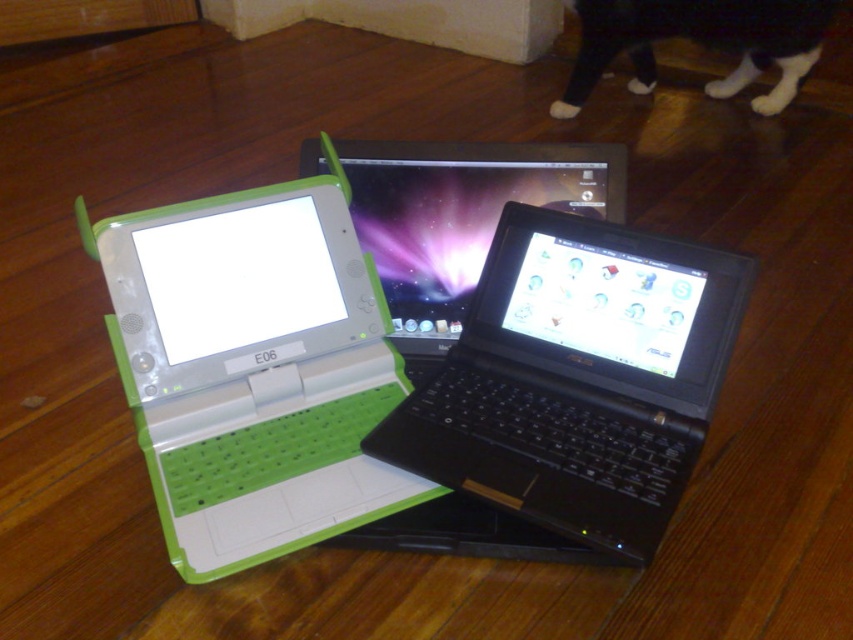
Does black plastic laptop at center appear under black glossy laptop at center?

Indeed, black plastic laptop at center is positioned under black glossy laptop at center.

Can you confirm if black plastic laptop at center is taller than black glossy laptop at center?

Correct, black plastic laptop at center is much taller as black glossy laptop at center.

Between point (512, 385) and point (544, 163), which one is positioned in front?

Point (512, 385) is in front.

The image size is (853, 640). I want to click on black plastic laptop at center, so click(x=577, y=378).

Is black plastic laptop at center below black fur at upper center?

Yes.

Is point (654, 337) behind point (563, 99)?

No, it is not.

Does point (722, 355) come closer to viewer compared to point (659, 28)?

Yes, it is.

The width and height of the screenshot is (853, 640). I want to click on black plastic laptop at center, so click(577, 378).

Is black glossy laptop at center wider than black fur at upper center?

No, black glossy laptop at center is not wider than black fur at upper center.

Which is more to the right, black glossy laptop at center or black fur at upper center?

From the viewer's perspective, black fur at upper center appears more on the right side.

Describe the element at coordinates (459, 218) in the screenshot. This screenshot has width=853, height=640. I see `black glossy laptop at center` at that location.

The image size is (853, 640). Identify the location of black glossy laptop at center. (459, 218).